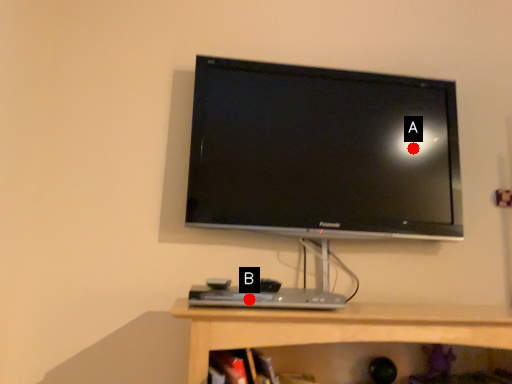
Question: Two points are circled on the image, labeled by A and B beside each circle. Which point is farther from the camera taking this photo?

Choices:
 (A) A is further
 (B) B is further

Answer: (A)